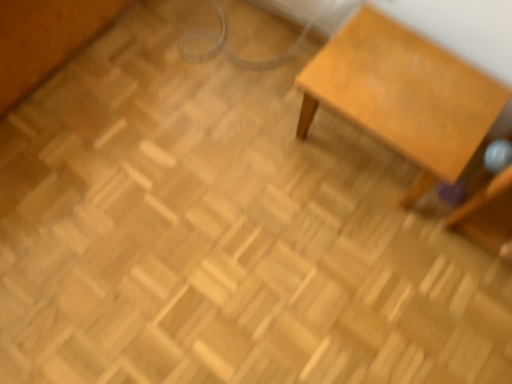
Locate an element on the screen. Image resolution: width=512 pixels, height=384 pixels. vacant space to the left of light brown wooden table at upper right is located at coordinates (256, 135).